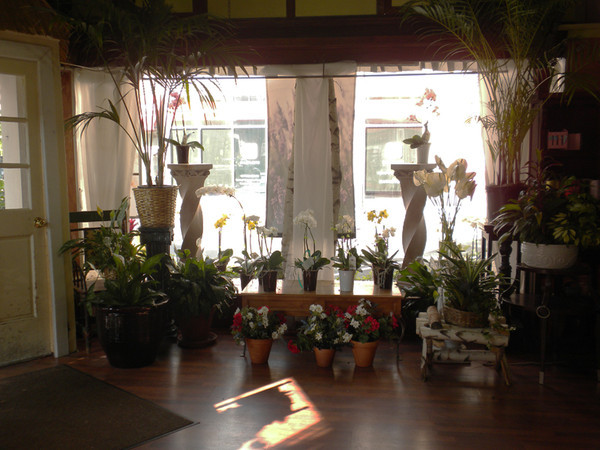
At what (x,y) coordinates should I click in order to perform the action: click on door mat. Please return your answer as a coordinate pair (x, y). Looking at the image, I should click on (63, 408).